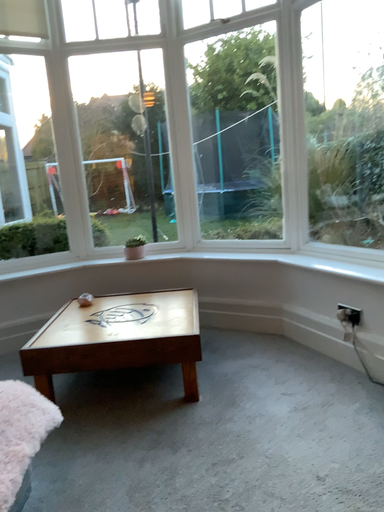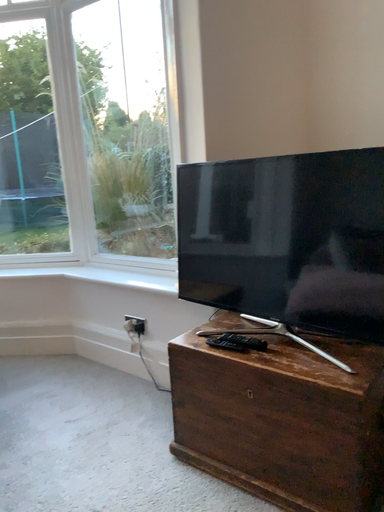
Question: Which way did the camera rotate in the video?

Choices:
 (A) rotated right
 (B) rotated left

Answer: (A)